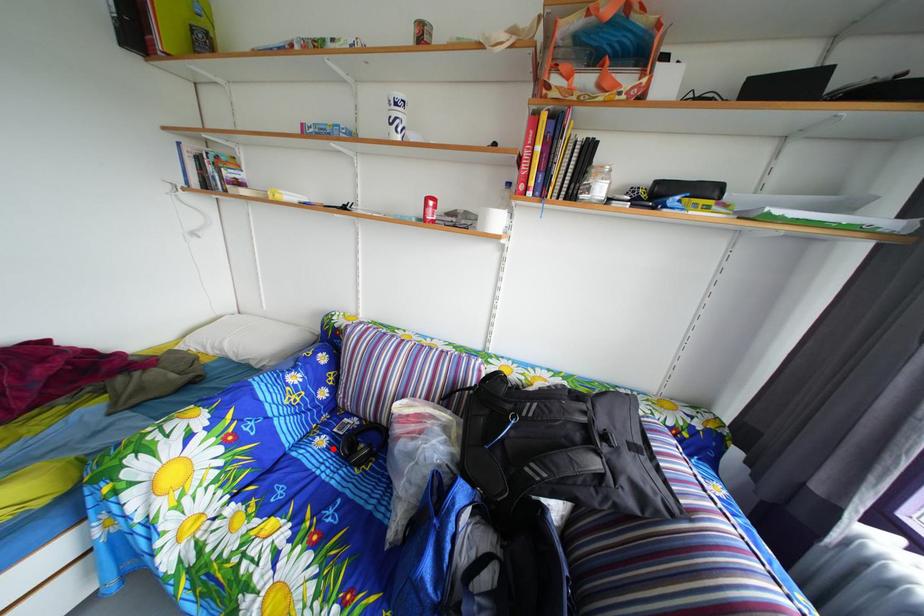
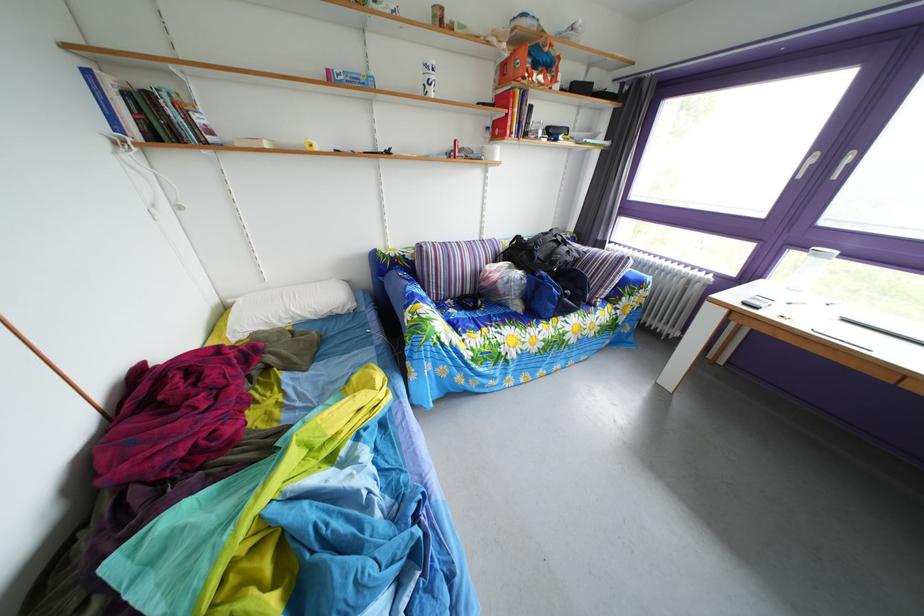
Where in the second image is the point corresponding to the highlighted location from the first image?

(463, 320)